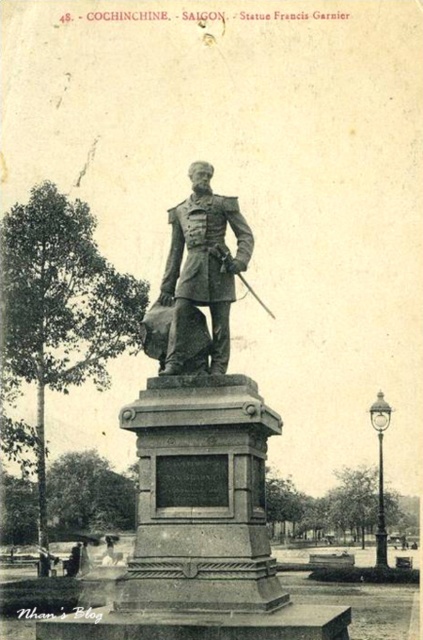
Based on the scene description, where is the bronze statue at center located in the image?

The bronze statue at center is located at point coordinates of (x=202, y=435).